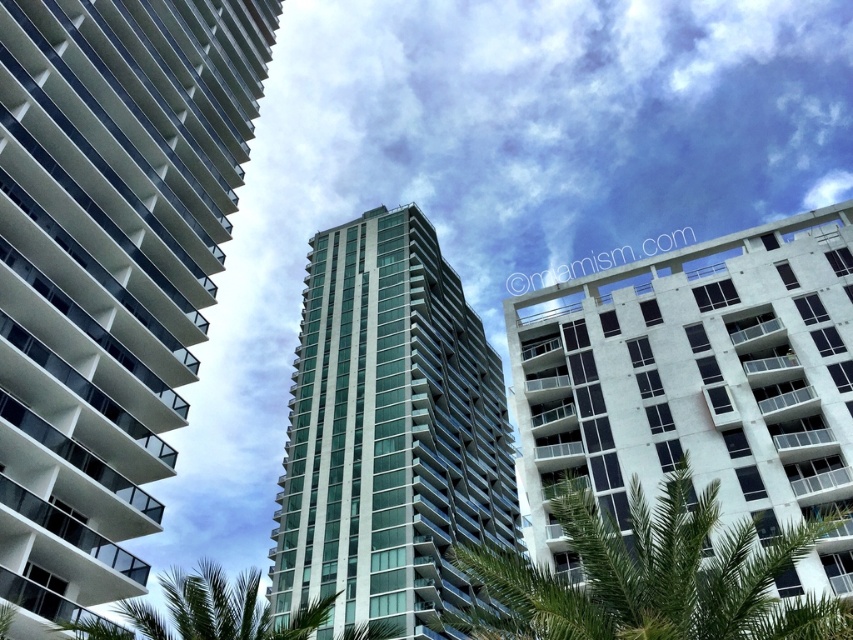
You are standing at the center of the image and want to take a photo of the white glass building at left without the green leafy palm tree at lower center blocking the view. Can you do this?

The white glass building at left is positioned over the green leafy palm tree at lower center, so the palm tree will block the view of the building. You cannot take a photo of the white glass building at left without the green leafy palm tree at lower center blocking the view.

You are a drone operator trying to capture aerial footage of the city. Your drone is currently hovering above the white glass building at left and needs to move towards the green leafy palm tree at center. Which direction should you fly to avoid obstacles between them?

Since the white glass building at left is closer to you than the green leafy palm tree at center, you should fly the drone upwards to avoid any potential obstacles between them.